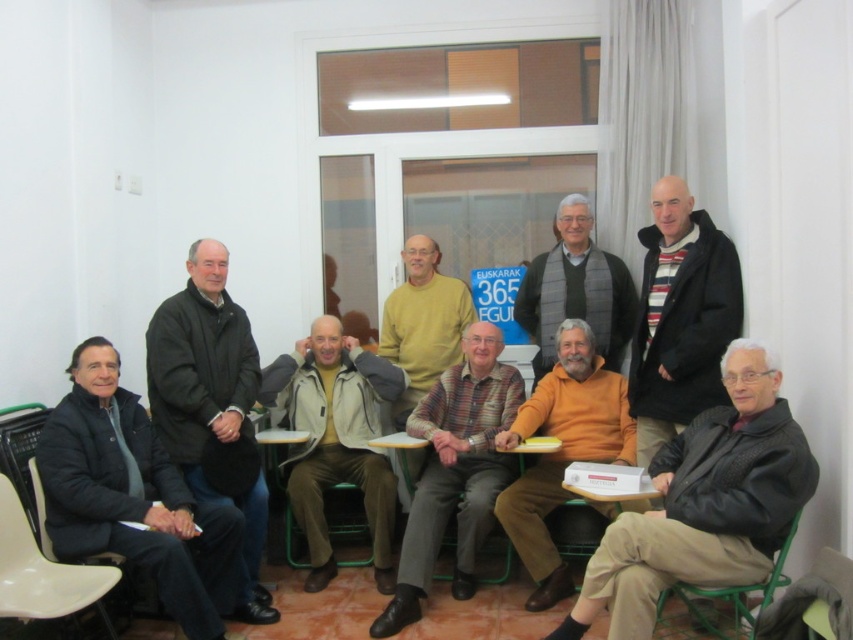
Question: Which point is closer to the camera?

Choices:
 (A) dark brown leather jacket at lower right
 (B) gray scarf at center
 (C) orange sweater at center
 (D) plaid fabric shirt at center

Answer: (A)

Question: Which of the following is the farthest from the observer?

Choices:
 (A) khaki fabric jacket at center
 (B) plaid fabric shirt at center
 (C) metallic plastic chair at lower left
 (D) gray scarf at center

Answer: (D)

Question: Estimate the real-world distances between objects in this image. Which object is closer to the gray scarf at center?

Choices:
 (A) orange sweater at center
 (B) green plastic chair at lower center
 (C) khaki fabric jacket at center
 (D) striped wool sweater at center

Answer: (A)

Question: Can you confirm if green plastic chair at lower center is positioned to the right of metallic plastic chair at lower left?

Choices:
 (A) yes
 (B) no

Answer: (A)

Question: Can you confirm if black matte jacket at left is positioned to the left of metallic plastic chair at lower left?

Choices:
 (A) no
 (B) yes

Answer: (A)

Question: Is dark blue jacket at left behind green plastic chair at lower center?

Choices:
 (A) yes
 (B) no

Answer: (B)